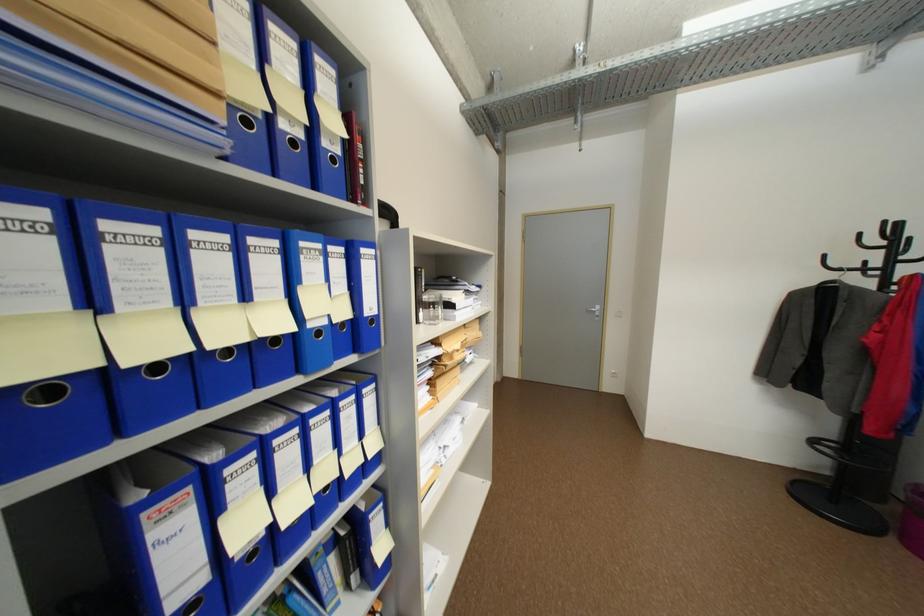
Find the location of `drinking glass`. drinking glass is located at coordinates (431, 308).